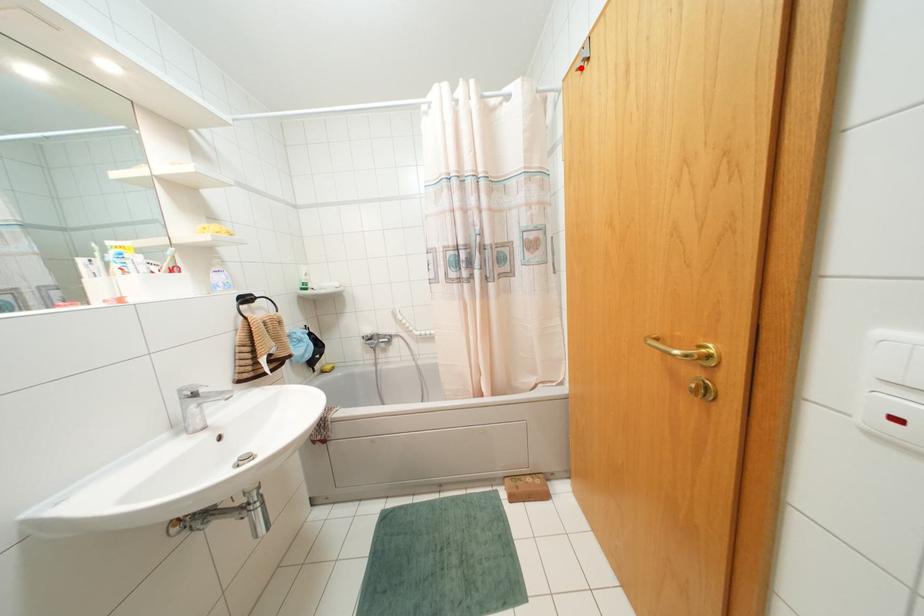
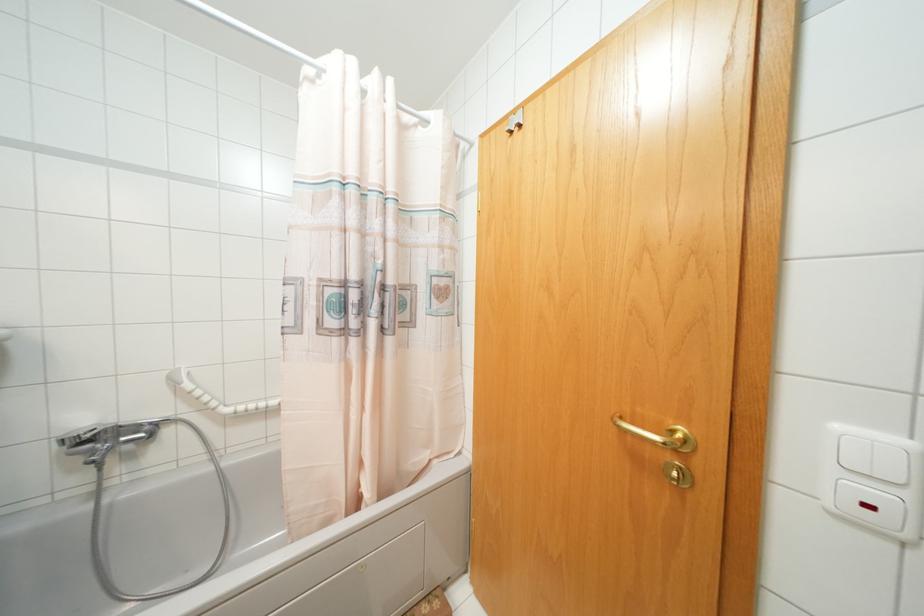
In the second image, find the point that corresponds to the highlighted location in the first image.

(511, 132)